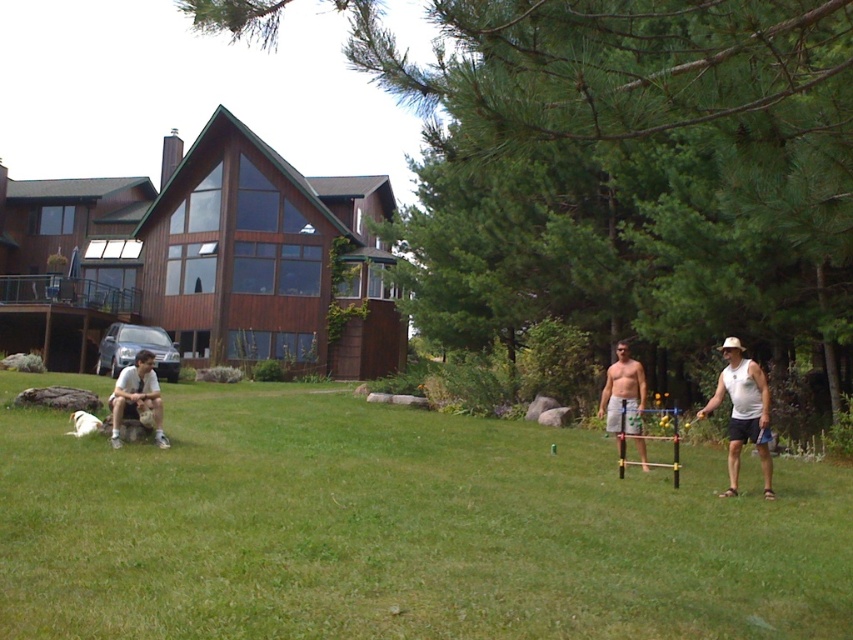
Question: Can you confirm if white plastic bag at right is positioned to the left of light brown fabric shirt at left?

Choices:
 (A) no
 (B) yes

Answer: (A)

Question: Is green grass at lower center to the left of white tank top at right from the viewer's perspective?

Choices:
 (A) no
 (B) yes

Answer: (B)

Question: Based on their relative distances, which object is farther from the shiny silver shorts at center?

Choices:
 (A) light brown fabric shirt at left
 (B) white tank top at right
 (C) white plastic bag at right

Answer: (A)

Question: Which of the following is the farthest from the observer?

Choices:
 (A) white plastic bag at right
 (B) shiny silver shorts at center
 (C) white tank top at right
 (D) green grass at lower center

Answer: (B)

Question: Is green grass at lower center thinner than white tank top at right?

Choices:
 (A) no
 (B) yes

Answer: (A)

Question: Which object is the farthest from the white tank top at right?

Choices:
 (A) green grass at lower center
 (B) light brown fabric shirt at left
 (C) white plastic bag at right
 (D) shiny silver shorts at center

Answer: (B)